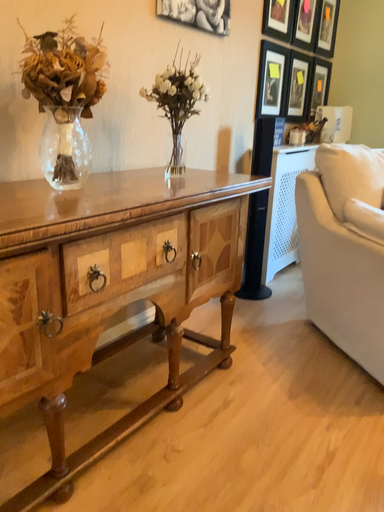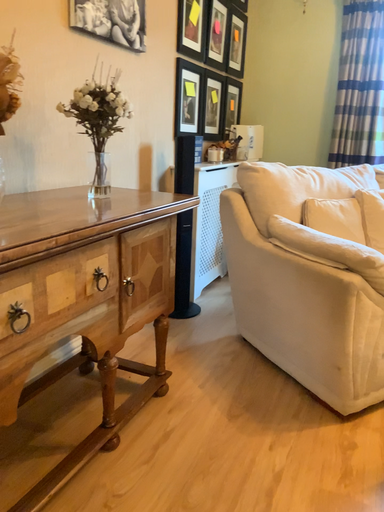
Question: Which way did the camera rotate in the video?

Choices:
 (A) rotated left
 (B) rotated right

Answer: (B)